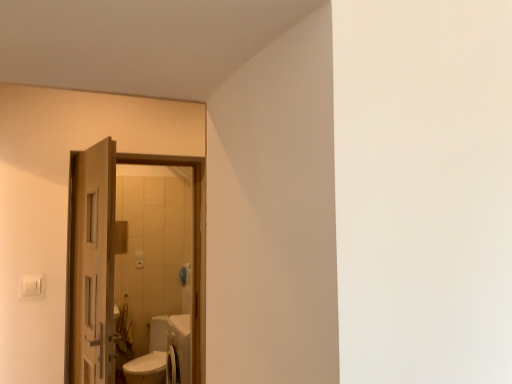
Question: Is wooden door at left, the first door when ordered from back to front, positioned behind wooden door at left, positioned as the second door in back-to-front order?

Choices:
 (A) no
 (B) yes

Answer: (B)

Question: Is wooden door at left, the first door when ordered from back to front, facing towards wooden door at left, placed as the 1th door when sorted from front to back?

Choices:
 (A) no
 (B) yes

Answer: (A)

Question: From a real-world perspective, is wooden door at left, the first door when ordered from back to front, below wooden door at left, positioned as the second door in back-to-front order?

Choices:
 (A) no
 (B) yes

Answer: (B)

Question: Is wooden door at left, the first door when ordered from back to front, touching wooden door at left, positioned as the second door in back-to-front order?

Choices:
 (A) no
 (B) yes

Answer: (B)

Question: Is wooden door at left, the first door when ordered from back to front, to the left of wooden door at left, placed as the 1th door when sorted from front to back, from the viewer's perspective?

Choices:
 (A) yes
 (B) no

Answer: (A)

Question: Is wooden door at left, positioned as the second door in back-to-front order, inside wooden door at left, marked as the second door in a front-to-back arrangement?

Choices:
 (A) yes
 (B) no

Answer: (B)

Question: Could wooden door at left, marked as the second door in a front-to-back arrangement, be considered to be inside wooden door at left, placed as the 1th door when sorted from front to back?

Choices:
 (A) no
 (B) yes

Answer: (A)

Question: Is wooden door at left, positioned as the second door in back-to-front order, bigger than wooden door at left, marked as the second door in a front-to-back arrangement?

Choices:
 (A) no
 (B) yes

Answer: (A)

Question: From a real-world perspective, is wooden door at left, placed as the 1th door when sorted from front to back, positioned under wooden door at left, marked as the second door in a front-to-back arrangement, based on gravity?

Choices:
 (A) no
 (B) yes

Answer: (A)

Question: Does wooden door at left, positioned as the second door in back-to-front order, come in front of wooden door at left, the first door when ordered from back to front?

Choices:
 (A) no
 (B) yes

Answer: (B)

Question: From the image's perspective, is wooden door at left, placed as the 1th door when sorted from front to back, on top of wooden door at left, marked as the second door in a front-to-back arrangement?

Choices:
 (A) no
 (B) yes

Answer: (B)

Question: Considering the relative positions of wooden door at left, placed as the 1th door when sorted from front to back, and wooden door at left, the first door when ordered from back to front, in the image provided, is wooden door at left, placed as the 1th door when sorted from front to back, to the left of wooden door at left, the first door when ordered from back to front, from the viewer's perspective?

Choices:
 (A) yes
 (B) no

Answer: (B)

Question: Is wooden door at left, marked as the second door in a front-to-back arrangement, wider or thinner than wooden door at left, placed as the 1th door when sorted from front to back?

Choices:
 (A) wide
 (B) thin

Answer: (A)